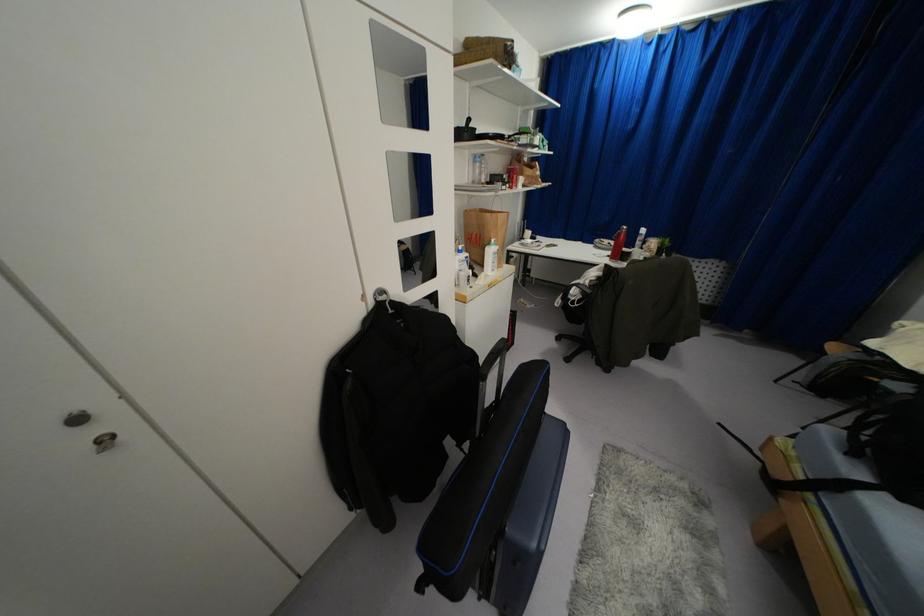
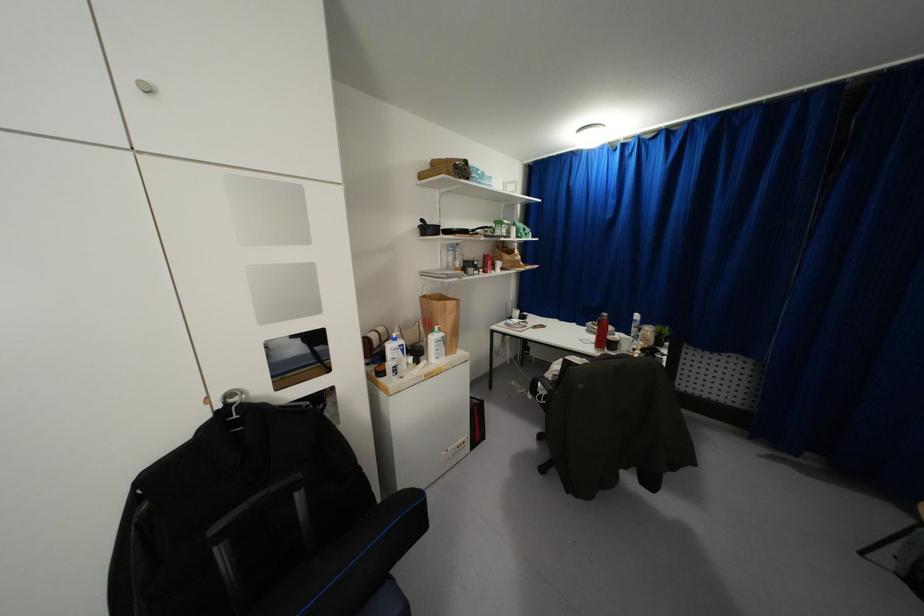
Where in the second image is the point corresponding to point (475, 161) from the first image?

(446, 249)